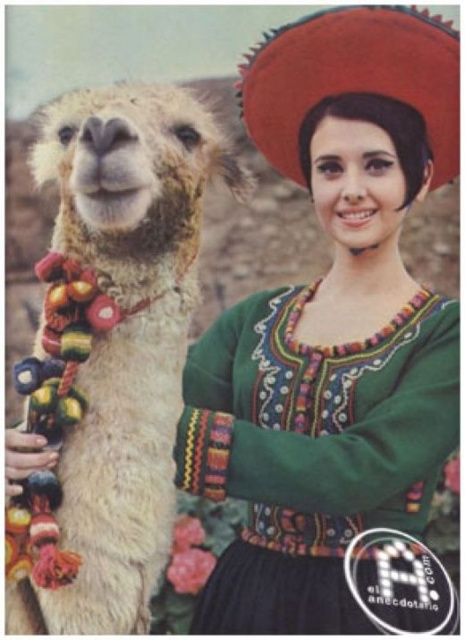
Between fuzzy white alpaca at left and red felt sombrero at upper right, which one has more height?

Standing taller between the two is fuzzy white alpaca at left.

The image size is (465, 640). I want to click on fuzzy white alpaca at left, so click(108, 353).

Does green embroidered dress at center have a greater height compared to red felt sombrero at upper right?

Yes.

Which is behind, point (266, 541) or point (449, 35)?

The point (266, 541) is behind.

This screenshot has width=465, height=640. Find the location of `green embroidered dress at center`. green embroidered dress at center is located at coordinates (312, 451).

Between fuzzy white alpaca at left and green embroidered dress at center, which one appears on the right side from the viewer's perspective?

From the viewer's perspective, green embroidered dress at center appears more on the right side.

Does point (110, 541) come closer to viewer compared to point (203, 374)?

Yes, it is.

Identify the location of fuzzy white alpaca at left. This screenshot has width=465, height=640. (108, 353).

Find the location of a particular element. This screenshot has height=640, width=465. fuzzy white alpaca at left is located at coordinates (108, 353).